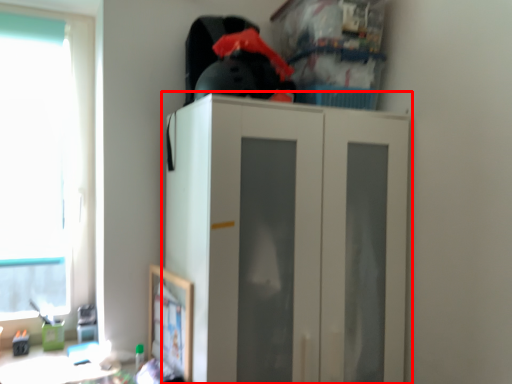
Question: Observing the image, what is the correct spatial positioning of cupboard (annotated by the red box) in reference to window?

Choices:
 (A) right
 (B) left

Answer: (A)